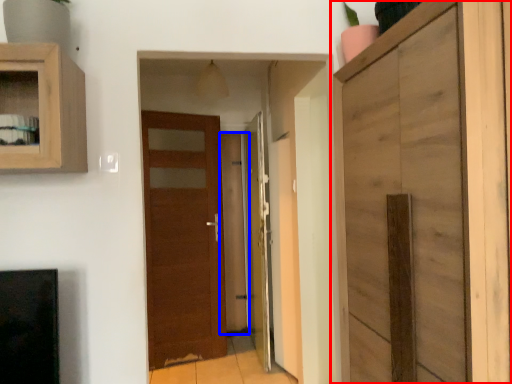
Question: Which object appears farthest to the camera in this image, cupboard (highlighted by a red box) or glass door (highlighted by a blue box)?

Choices:
 (A) cupboard
 (B) glass door

Answer: (B)